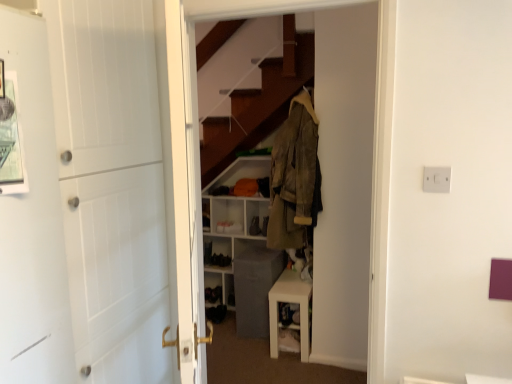
Question: From the image's perspective, does white matte door at left appear higher than leather-like brown coat at center?

Choices:
 (A) yes
 (B) no

Answer: (B)

Question: Does white matte door at left have a larger size compared to leather-like brown coat at center?

Choices:
 (A) no
 (B) yes

Answer: (B)

Question: From a real-world perspective, is white matte door at left positioned over leather-like brown coat at center based on gravity?

Choices:
 (A) yes
 (B) no

Answer: (B)

Question: Would you say white matte door at left is outside leather-like brown coat at center?

Choices:
 (A) no
 (B) yes

Answer: (B)

Question: Is leather-like brown coat at center at the back of white matte door at left?

Choices:
 (A) no
 (B) yes

Answer: (A)

Question: From the image's perspective, is brown fabric coat at center above or below black fabric shoe at lower center, which is the second shoe in left-to-right order?

Choices:
 (A) above
 (B) below

Answer: (A)

Question: Considering the positions of brown fabric coat at center and black fabric shoe at lower center, which is the second shoe from right to left, in the image, is brown fabric coat at center bigger or smaller than black fabric shoe at lower center, which is the second shoe from right to left,?

Choices:
 (A) small
 (B) big

Answer: (B)

Question: Is brown fabric coat at center inside or outside of black fabric shoe at lower center, which is the second shoe from right to left?

Choices:
 (A) inside
 (B) outside

Answer: (B)

Question: Is point (367, 18) closer or farther from the camera than point (216, 254)?

Choices:
 (A) closer
 (B) farther

Answer: (A)

Question: From their relative heights in the image, would you say white matte table at lower center is taller or shorter than brown fabric coat at center?

Choices:
 (A) tall
 (B) short

Answer: (B)

Question: Is white matte table at lower center to the left or to the right of brown fabric coat at center in the image?

Choices:
 (A) right
 (B) left

Answer: (A)

Question: From a real-world perspective, is white matte table at lower center above or below brown fabric coat at center?

Choices:
 (A) above
 (B) below

Answer: (B)

Question: Considering their positions, is white matte table at lower center located in front of or behind brown fabric coat at center?

Choices:
 (A) front
 (B) behind

Answer: (B)

Question: From their relative heights in the image, would you say brown fabric coat at center is taller or shorter than metallic silver picture frame at upper left?

Choices:
 (A) tall
 (B) short

Answer: (A)

Question: In the image, is brown fabric coat at center positioned in front of or behind metallic silver picture frame at upper left?

Choices:
 (A) front
 (B) behind

Answer: (B)